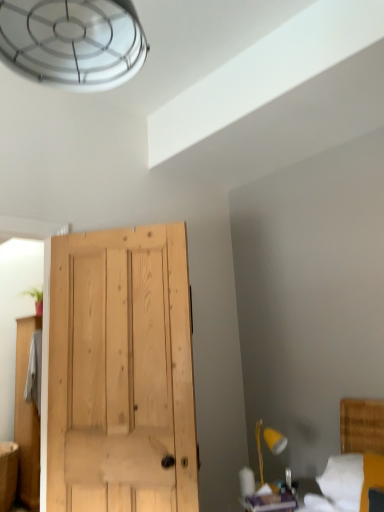
Question: Does yellow wood lamp at lower right come in front of white fabric bed at lower right?

Choices:
 (A) no
 (B) yes

Answer: (A)

Question: Can you confirm if yellow wood lamp at lower right is thinner than white fabric bed at lower right?

Choices:
 (A) no
 (B) yes

Answer: (B)

Question: Is yellow wood lamp at lower right to the left of white fabric bed at lower right from the viewer's perspective?

Choices:
 (A) no
 (B) yes

Answer: (B)

Question: Does yellow wood lamp at lower right turn towards white fabric bed at lower right?

Choices:
 (A) no
 (B) yes

Answer: (A)

Question: Is yellow wood lamp at lower right positioned beyond the bounds of white fabric bed at lower right?

Choices:
 (A) yes
 (B) no

Answer: (A)

Question: From a real-world perspective, is yellow wood lamp at lower right physically located above or below matte wood vanity at lower left?

Choices:
 (A) below
 (B) above

Answer: (B)

Question: Is yellow wood lamp at lower right to the left or to the right of matte wood vanity at lower left in the image?

Choices:
 (A) left
 (B) right

Answer: (B)

Question: In terms of height, does yellow wood lamp at lower right look taller or shorter compared to matte wood vanity at lower left?

Choices:
 (A) short
 (B) tall

Answer: (A)

Question: From the image's perspective, is yellow wood lamp at lower right located above or below matte wood vanity at lower left?

Choices:
 (A) above
 (B) below

Answer: (A)

Question: Would you say white fabric bed at lower right is to the left or to the right of yellow wood lamp at lower right in the picture?

Choices:
 (A) right
 (B) left

Answer: (A)

Question: Is white fabric bed at lower right bigger or smaller than yellow wood lamp at lower right?

Choices:
 (A) big
 (B) small

Answer: (A)

Question: Is point (354, 463) closer or farther from the camera than point (258, 431)?

Choices:
 (A) farther
 (B) closer

Answer: (B)

Question: Looking at their shapes, would you say white fabric bed at lower right is wider or thinner than yellow wood lamp at lower right?

Choices:
 (A) wide
 (B) thin

Answer: (A)

Question: In the image, is white fabric bed at lower right positioned in front of or behind matte wood vanity at lower left?

Choices:
 (A) behind
 (B) front

Answer: (B)

Question: Considering the positions of white fabric bed at lower right and matte wood vanity at lower left in the image, is white fabric bed at lower right taller or shorter than matte wood vanity at lower left?

Choices:
 (A) tall
 (B) short

Answer: (B)